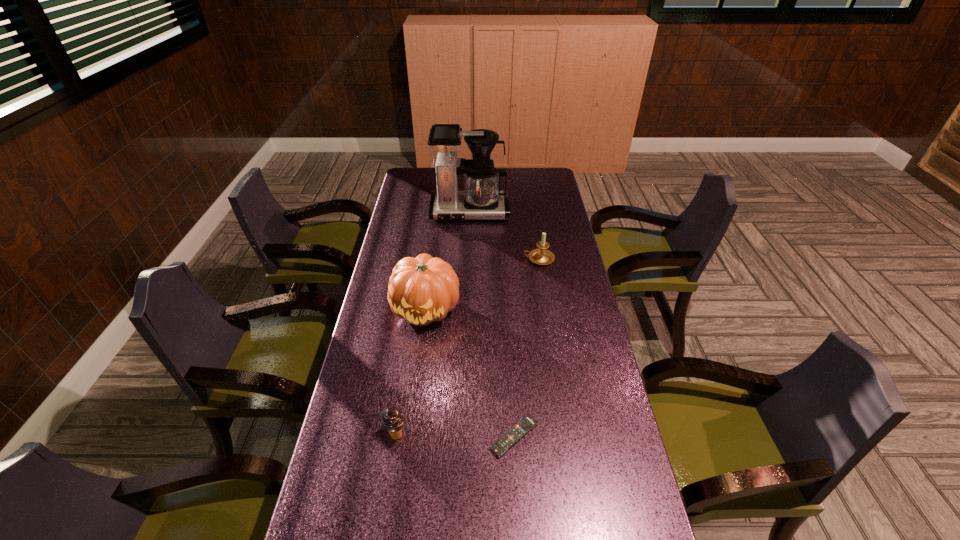
Where is `the second closest object to the second farthest object`? the second closest object to the second farthest object is located at coordinates (424, 289).

Locate an element on the screen. The image size is (960, 540). object that stands as the third closest to the icecream is located at coordinates 542,256.

Image resolution: width=960 pixels, height=540 pixels. I want to click on free region that satisfies the following two spatial constraints: 1. on the front side of the remote control; 2. on the right side of the icecream, so click(396, 436).

Locate an element on the screen. The image size is (960, 540). free space that satisfies the following two spatial constraints: 1. with a handle on the side of the rightmost object; 2. on the front side of the icecream is located at coordinates (567, 435).

You are a GUI agent. You are given a task and a screenshot of the screen. Output one action in this format:
    pyautogui.click(x=<x>, y=<y>)
    Task: Click on the free space in the image that satisfies the following two spatial constraints: 1. on the carved face of the remote control; 2. on the left side of the second tallest object
    Image resolution: width=960 pixels, height=540 pixels.
    Given the screenshot: What is the action you would take?
    pyautogui.click(x=410, y=436)